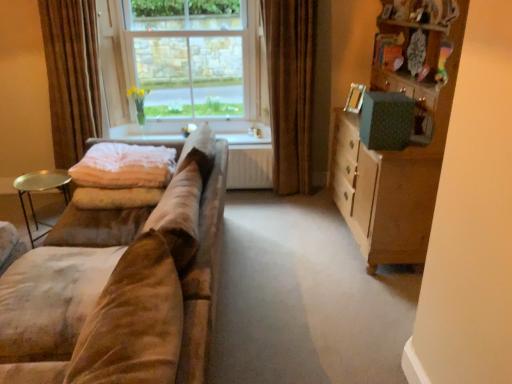
Question: Is point (233, 66) positioned closer to the camera than point (113, 180)?

Choices:
 (A) closer
 (B) farther

Answer: (B)

Question: Is clear glass window at center inside or outside of pink soft fabric blanket at left?

Choices:
 (A) outside
 (B) inside

Answer: (A)

Question: Which object is the closest to the wooden cabinet at right?

Choices:
 (A) gold metallic tray at left
 (B) brown velvet curtain at left, positioned as the 1th curtain in left-to-right order
 (C) pink soft fabric blanket at left
 (D) brown velvet curtain at center, the 2th curtain viewed from the left
 (E) clear glass window at center

Answer: (D)

Question: Which is nearer to the white glossy window sill at center?

Choices:
 (A) brown velvet curtain at left, positioned as the 1th curtain in left-to-right order
 (B) brown velvet curtain at center, the 2th curtain viewed from the left
 (C) suede couch at left
 (D) gold metallic tray at left
 (E) wooden cabinet at right

Answer: (B)